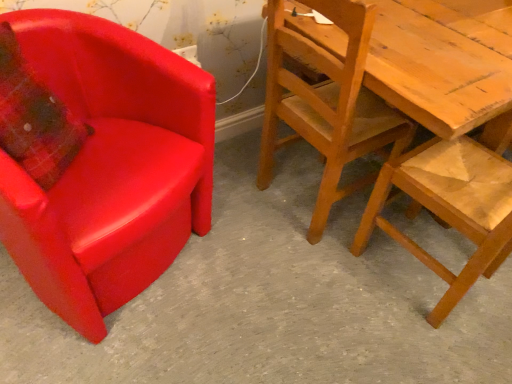
Identify the location of free spot in front of wooden chair at right, positioned as the 2th chair in right-to-left order. (304, 276).